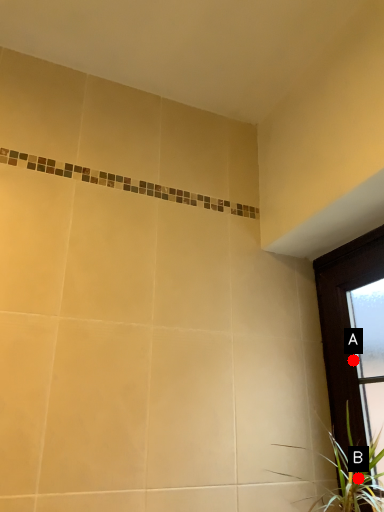
Question: Two points are circled on the image, labeled by A and B beside each circle. Among these points, which one is farthest from the camera?

Choices:
 (A) A is further
 (B) B is further

Answer: (A)